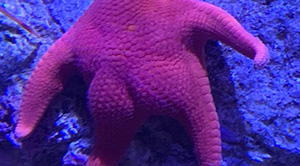
The height and width of the screenshot is (166, 300). I want to click on light, so click(251, 86), click(258, 115).